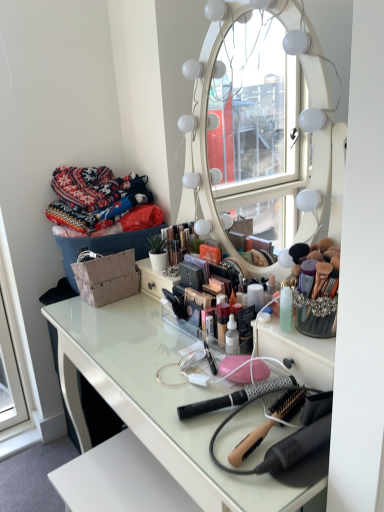
Locate an element on the screen. The width and height of the screenshot is (384, 512). free space to the left of wooden-handled hairbrush at center, which is counted as the second brush, starting from the back is located at coordinates (192, 419).